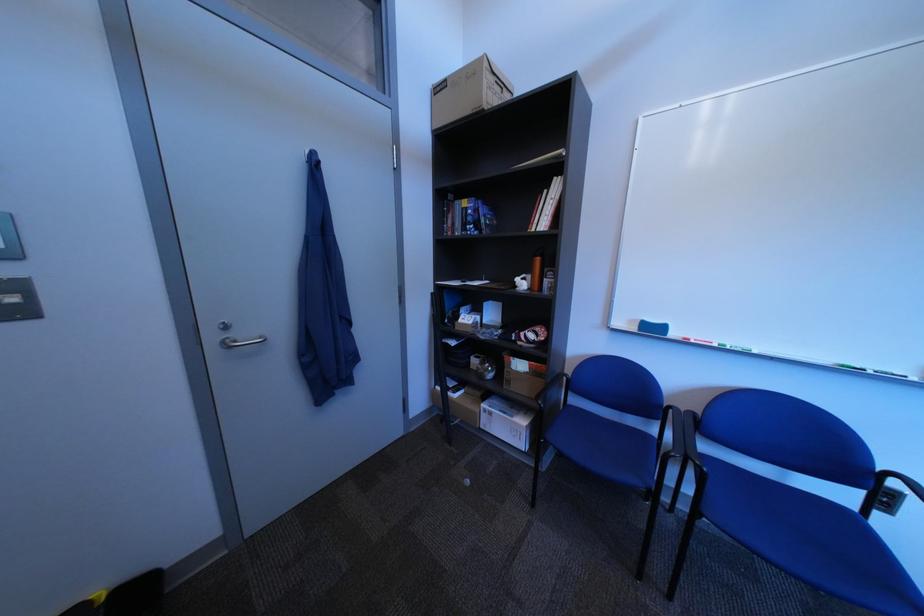
Find where to push the light switch. Please return your answer as a coordinate pair (x, y).

(889, 500)